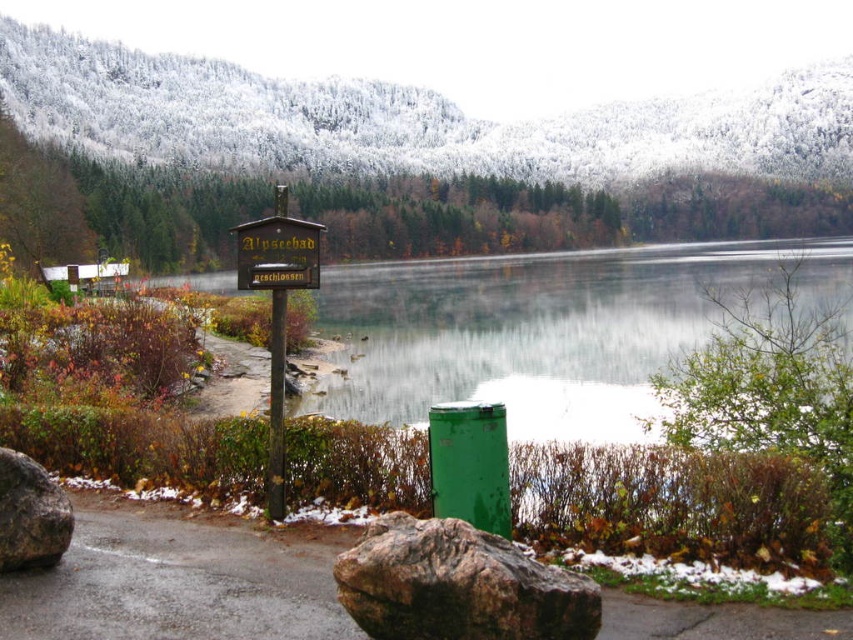
You are a hiker who wants to read the text on both wooden sign at left and wooden sign at center. Which sign should you look up to read?

The wooden sign at left is located above the wooden sign at center, so you should look up to read the wooden sign at left.